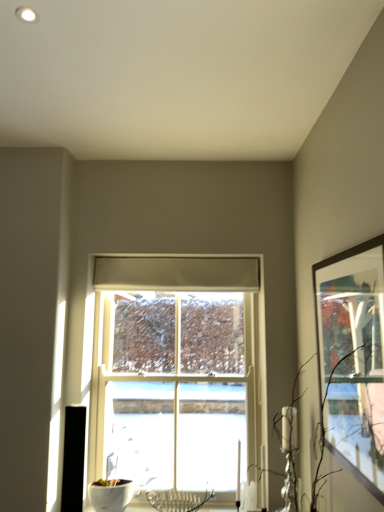
Question: Is matte black picture frame at right positioned behind white wooden window at center?

Choices:
 (A) no
 (B) yes

Answer: (A)

Question: Considering the relative sizes of matte black picture frame at right and white wooden window at center in the image provided, is matte black picture frame at right wider than white wooden window at center?

Choices:
 (A) no
 (B) yes

Answer: (A)

Question: Is matte black picture frame at right not within white wooden window at center?

Choices:
 (A) yes
 (B) no

Answer: (A)

Question: Does matte black picture frame at right lie in front of white wooden window at center?

Choices:
 (A) no
 (B) yes

Answer: (B)

Question: Does matte black picture frame at right have a lesser height compared to white wooden window at center?

Choices:
 (A) yes
 (B) no

Answer: (A)

Question: Can you confirm if matte black picture frame at right is taller than white wooden window at center?

Choices:
 (A) no
 (B) yes

Answer: (A)

Question: Does matte black picture frame at right have a lesser height compared to brown matte branch at right?

Choices:
 (A) yes
 (B) no

Answer: (B)

Question: Is matte black picture frame at right wider than brown matte branch at right?

Choices:
 (A) yes
 (B) no

Answer: (B)

Question: Is matte black picture frame at right aimed at brown matte branch at right?

Choices:
 (A) yes
 (B) no

Answer: (A)

Question: Does matte black picture frame at right have a lesser width compared to brown matte branch at right?

Choices:
 (A) yes
 (B) no

Answer: (A)

Question: From a real-world perspective, is matte black picture frame at right on top of brown matte branch at right?

Choices:
 (A) no
 (B) yes

Answer: (B)

Question: Is matte black picture frame at right surrounding brown matte branch at right?

Choices:
 (A) yes
 (B) no

Answer: (B)

Question: Is brown matte branch at right positioned with its back to white wooden window at center?

Choices:
 (A) yes
 (B) no

Answer: (B)